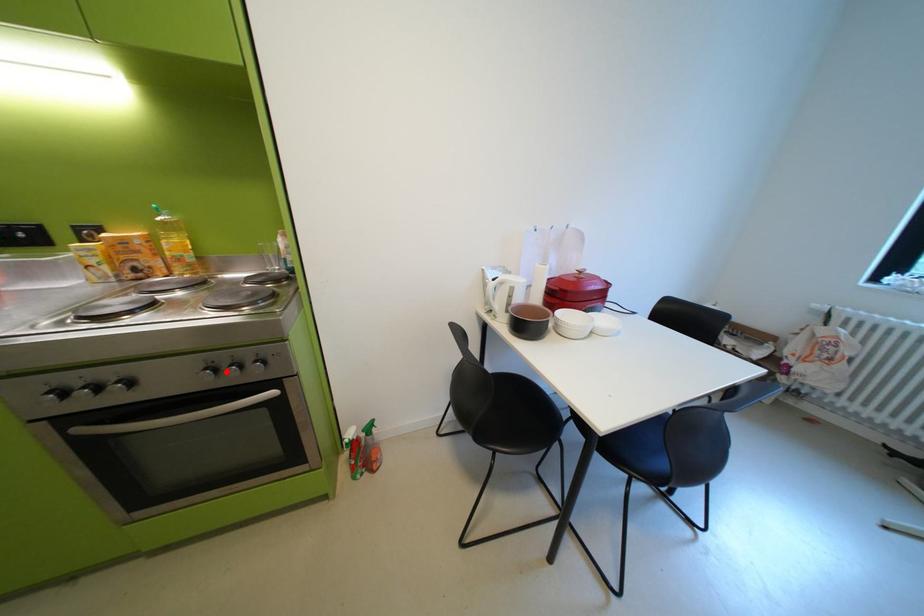
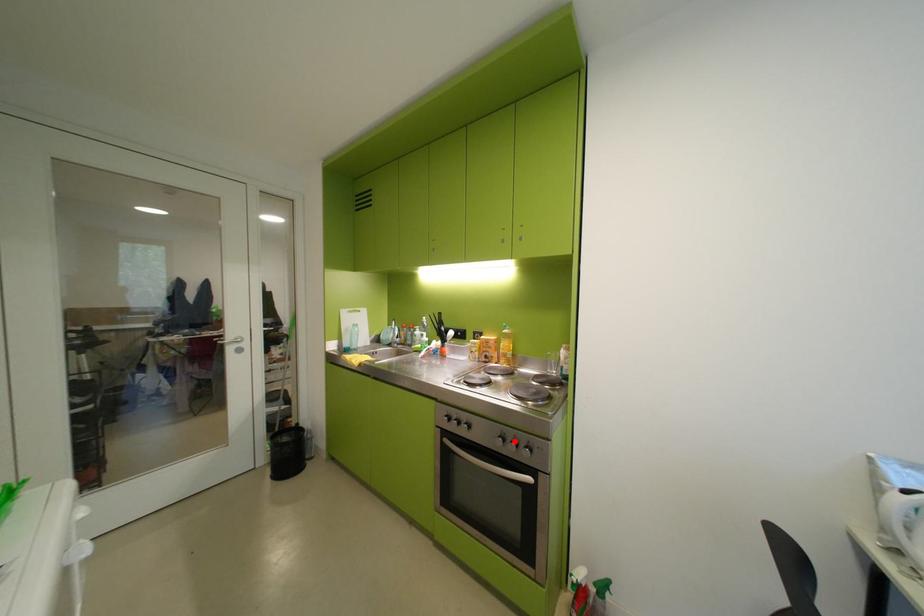
I am providing you with two images of the same scene from different viewpoints. A red point is marked on the first image and another point is marked on the second image. Does the point marked in image1 correspond to the same location as the one in image2?

Yes